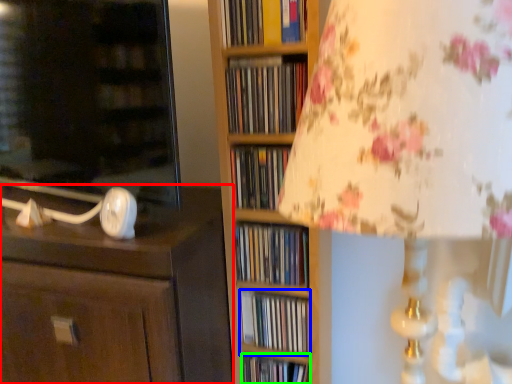
Question: Considering the real-world distances, which object is closest to chest of drawers (highlighted by a red box)? book (highlighted by a blue box) or book (highlighted by a green box).

Choices:
 (A) book
 (B) book

Answer: (A)